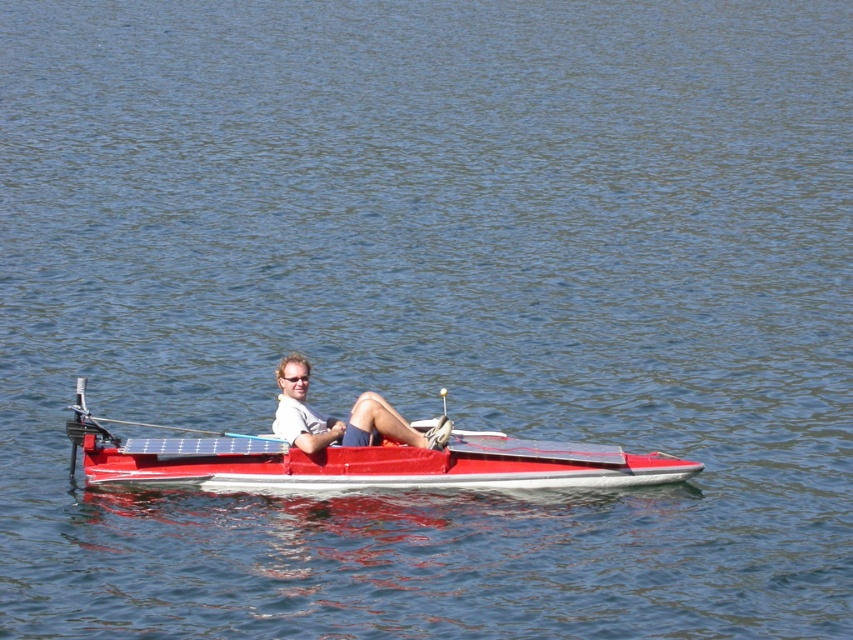
You are a photographer trying to capture a photo of the metallic red boat at center and the white matte shirt at center. Which object should you focus on first if you want to ensure both are in the frame without adjusting your camera angle?

You should focus on the metallic red boat at center first because it is taller than the white matte shirt at center, so it will occupy more space in the frame and help ensure both are visible without needing to adjust the camera angle.

You are a photographer trying to capture the reflection of the blue plastic paddle at center in the water. Since the white matte shirt at center is covering part of the paddle, will you need to adjust the angle of your camera to see the entire paddle?

The white matte shirt at center is positioned over blue plastic paddle at center, so yes, you will need to adjust the angle of your camera to see the entire paddle.